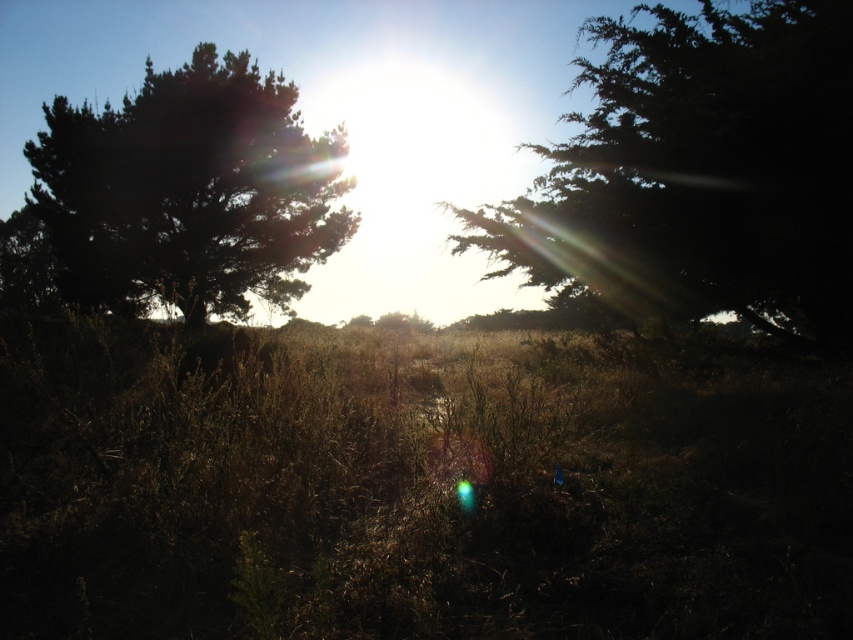
Question: Which object appears closest to the camera in this image?

Choices:
 (A) dark green textured tree at upper right
 (B) dark green textured tree at left

Answer: (A)

Question: Can you confirm if dark green textured tree at upper right is positioned above dark green textured tree at left?

Choices:
 (A) yes
 (B) no

Answer: (A)

Question: Among these objects, which one is nearest to the camera?

Choices:
 (A) dark green textured tree at left
 (B) dark green textured tree at upper right

Answer: (B)

Question: Which point is closer to the camera?

Choices:
 (A) (786, 147)
 (B) (200, 308)

Answer: (A)

Question: Does dark green textured tree at upper right have a smaller size compared to dark green textured tree at left?

Choices:
 (A) yes
 (B) no

Answer: (B)

Question: Can you confirm if dark green textured tree at upper right is positioned to the right of dark green textured tree at left?

Choices:
 (A) yes
 (B) no

Answer: (A)